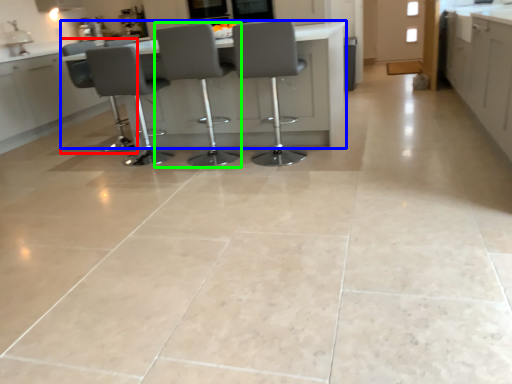
Question: Considering the real-world distances, which object is farthest from chair (highlighted by a red box)? table (highlighted by a blue box) or chair (highlighted by a green box)?

Choices:
 (A) table
 (B) chair

Answer: (B)